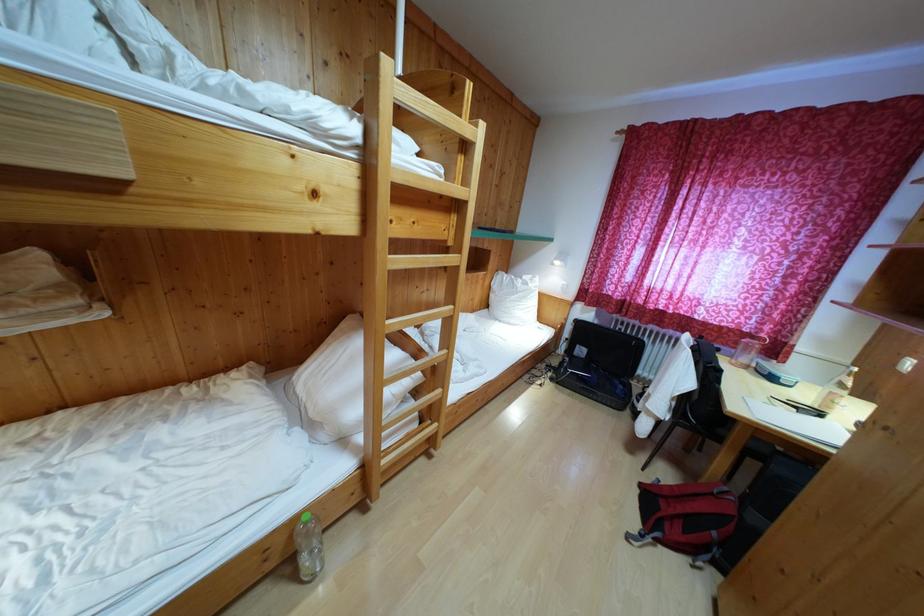
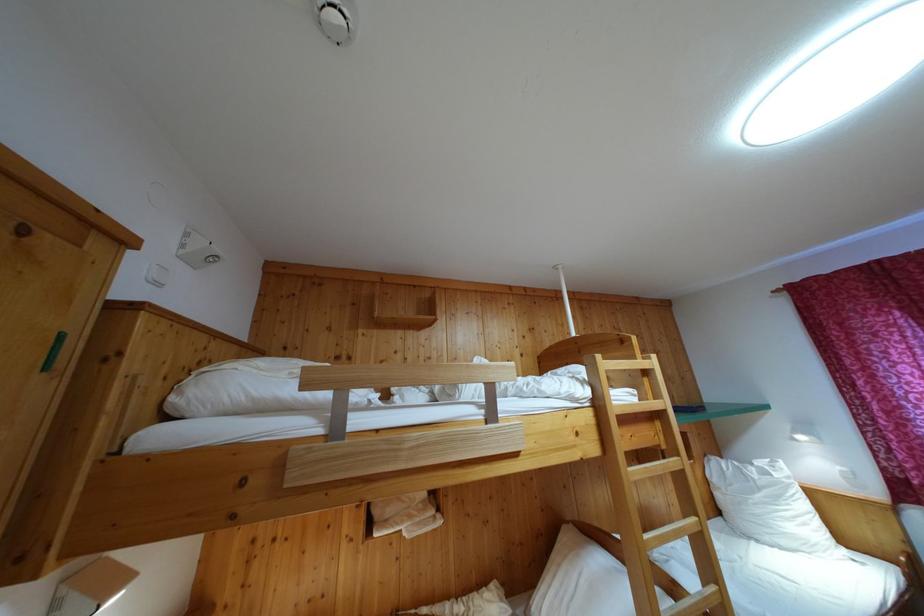
Where in the second image is the point corresponding to the point at 525,285 from the first image?

(755, 471)